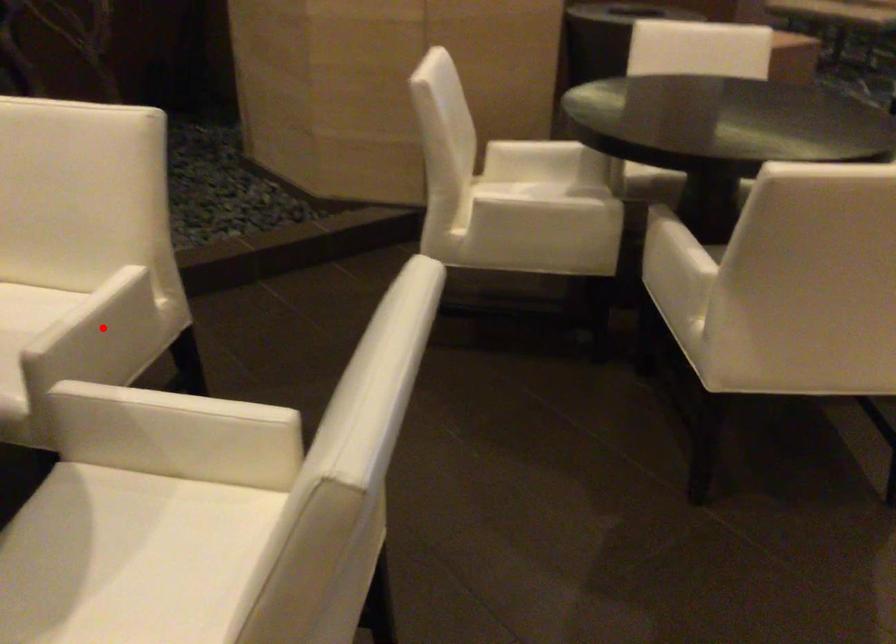
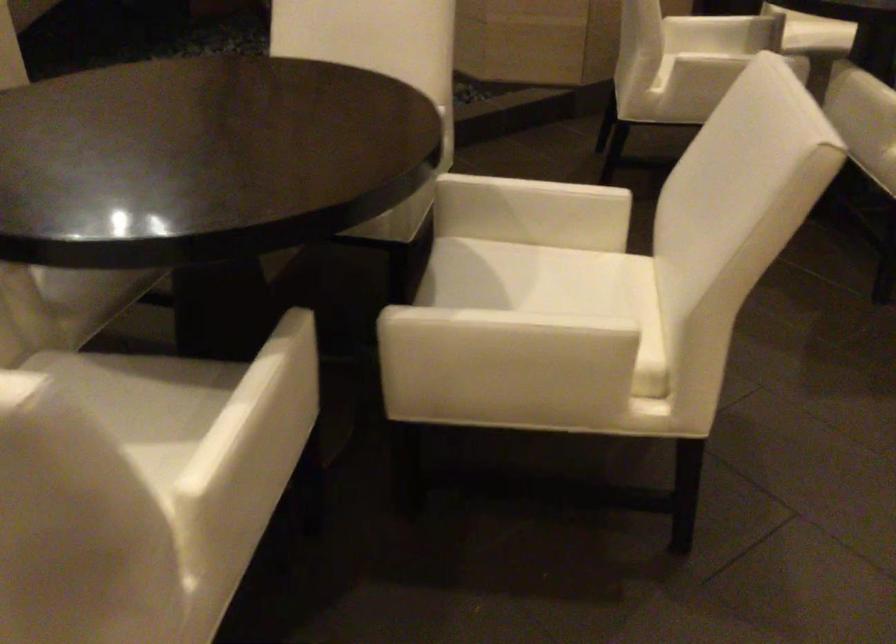
Question: I am providing you with two images of the same scene from different viewpoints. A red point is marked on the first image. Can you still see the location of the red point in image 2?

Choices:
 (A) Yes
 (B) No

Answer: (B)